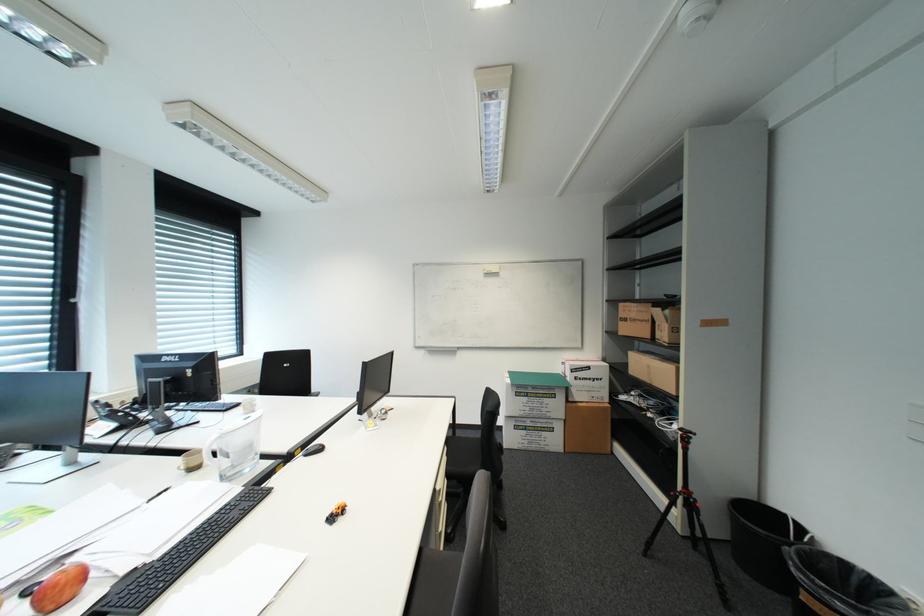
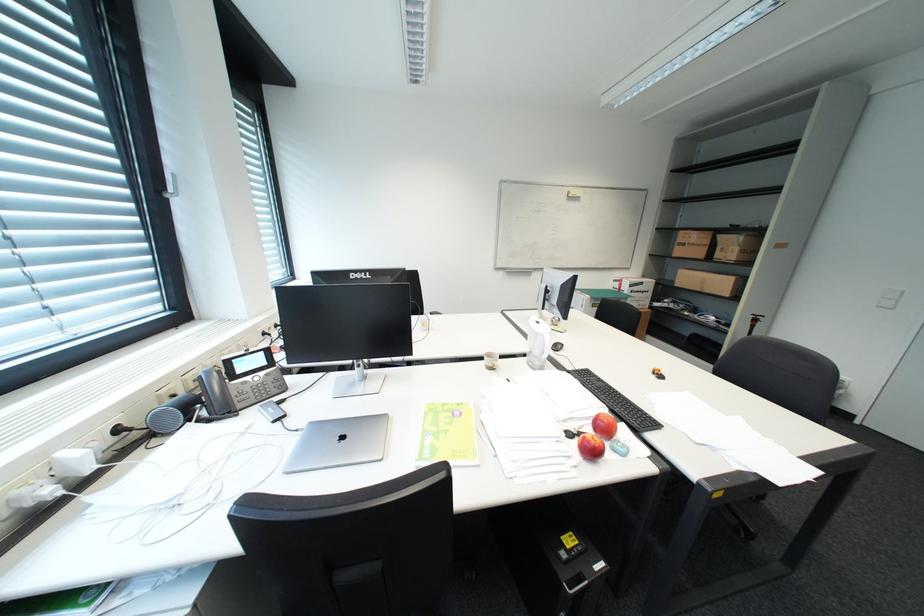
Question: In a continuous first-person perspective shot, in which direction is the camera moving?

Choices:
 (A) Left
 (B) Right
 (C) Forward
 (D) Backward

Answer: (A)